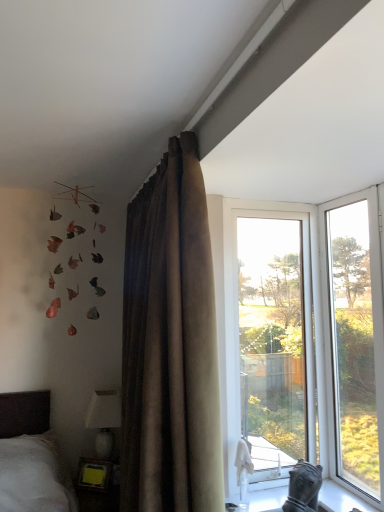
Question: From a real-world perspective, is transparent glass window at center, which ranks as the first window in left-to-right order, under white glossy lampshade at lower left?

Choices:
 (A) no
 (B) yes

Answer: (A)

Question: From a real-world perspective, is transparent glass window at center, which is counted as the second window, starting from the right, over white glossy lampshade at lower left?

Choices:
 (A) no
 (B) yes

Answer: (B)

Question: Does transparent glass window at center, which ranks as the first window in left-to-right order, have a lesser width compared to white glossy lampshade at lower left?

Choices:
 (A) no
 (B) yes

Answer: (B)

Question: Is transparent glass window at center, which ranks as the first window in left-to-right order, bigger than white glossy lampshade at lower left?

Choices:
 (A) no
 (B) yes

Answer: (B)

Question: From the image's perspective, is transparent glass window at center, which is counted as the second window, starting from the right, over white glossy lampshade at lower left?

Choices:
 (A) no
 (B) yes

Answer: (B)

Question: Considering the positions of transparent glass window at center, which is counted as the second window, starting from the right, and transparent glass window at right, the 2th window in the left-to-right sequence, in the image, is transparent glass window at center, which is counted as the second window, starting from the right, wider or thinner than transparent glass window at right, the 2th window in the left-to-right sequence,?

Choices:
 (A) wide
 (B) thin

Answer: (A)

Question: Considering the positions of point (301, 352) and point (347, 266), is point (301, 352) closer or farther from the camera than point (347, 266)?

Choices:
 (A) closer
 (B) farther

Answer: (A)

Question: From a real-world perspective, is transparent glass window at center, which is counted as the second window, starting from the right, positioned above or below transparent glass window at right, the 2th window in the left-to-right sequence?

Choices:
 (A) above
 (B) below

Answer: (B)

Question: Relative to transparent glass window at right, arranged as the first window when viewed from the right, is transparent glass window at center, which is counted as the second window, starting from the right, in front or behind?

Choices:
 (A) front
 (B) behind

Answer: (B)

Question: In the image, is white glossy lampshade at lower left positioned in front of or behind transparent glass window at right, the 2th window in the left-to-right sequence?

Choices:
 (A) front
 (B) behind

Answer: (B)

Question: Would you say white glossy lampshade at lower left is to the left or to the right of transparent glass window at right, the 2th window in the left-to-right sequence, in the picture?

Choices:
 (A) right
 (B) left

Answer: (B)

Question: In terms of width, does white glossy lampshade at lower left look wider or thinner when compared to transparent glass window at right, arranged as the first window when viewed from the right?

Choices:
 (A) thin
 (B) wide

Answer: (B)

Question: Considering the positions of white glossy lampshade at lower left and transparent glass window at right, arranged as the first window when viewed from the right, in the image, is white glossy lampshade at lower left taller or shorter than transparent glass window at right, arranged as the first window when viewed from the right,?

Choices:
 (A) short
 (B) tall

Answer: (A)

Question: Considering their positions, is white glossy stone at lower right located in front of or behind wooden frame at lower left?

Choices:
 (A) front
 (B) behind

Answer: (A)

Question: From a real-world perspective, is white glossy stone at lower right above or below wooden frame at lower left?

Choices:
 (A) below
 (B) above

Answer: (B)